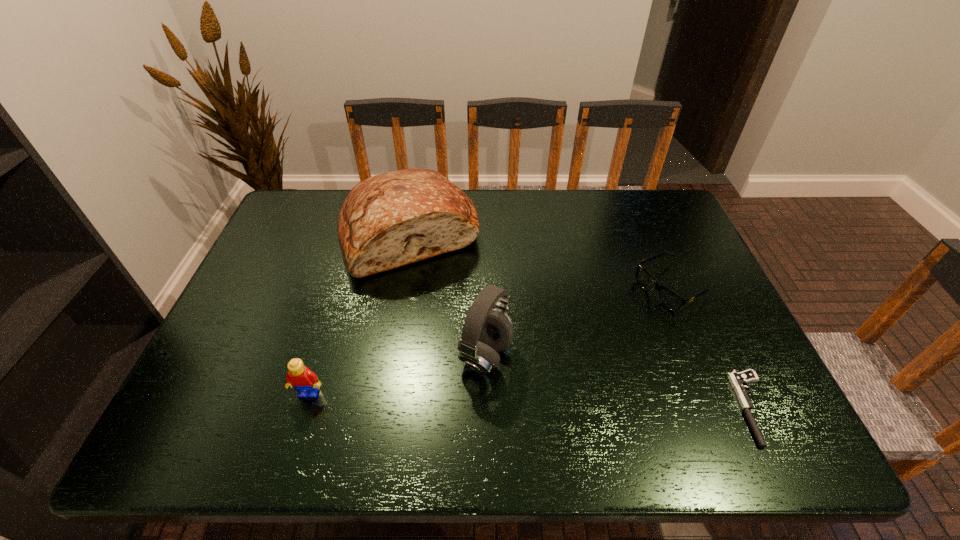
Locate an element on the screen. This screenshot has height=540, width=960. free space on the desktop that is between the third shortest object and the pistol and is positioned at the sliced front of the bread is located at coordinates (468, 398).

Where is `free space on the desktop that is between the third tallest object and the pistol and is positioned on the front-facing side of the sunglasses`? free space on the desktop that is between the third tallest object and the pistol and is positioned on the front-facing side of the sunglasses is located at coordinates (472, 399).

You are a GUI agent. You are given a task and a screenshot of the screen. Output one action in this format:
    pyautogui.click(x=<x>, y=<y>)
    Task: Click on the vacant space on the desktop that is between the third tallest object and the pistol and is positioned on the ear cups of the headset
    
    Given the screenshot: What is the action you would take?
    pyautogui.click(x=573, y=402)